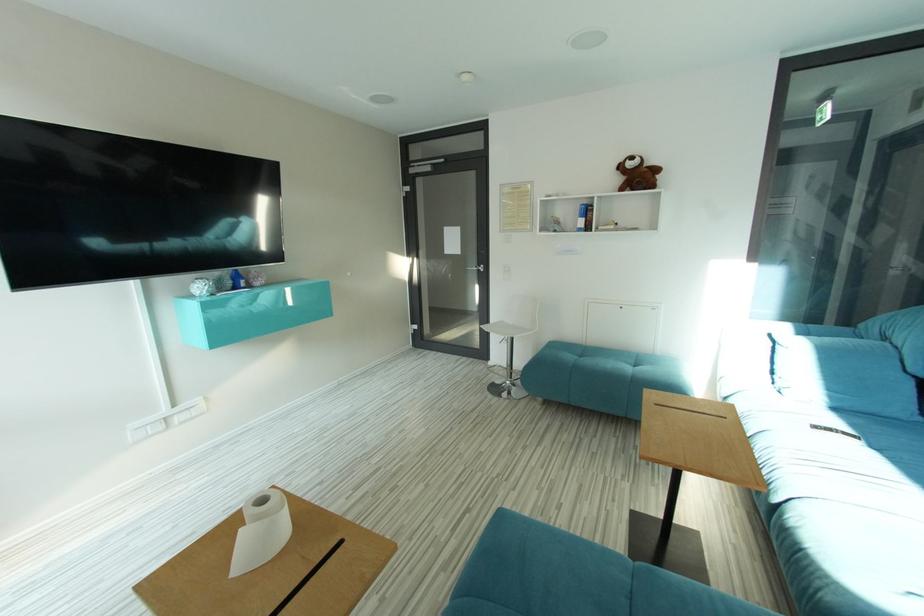
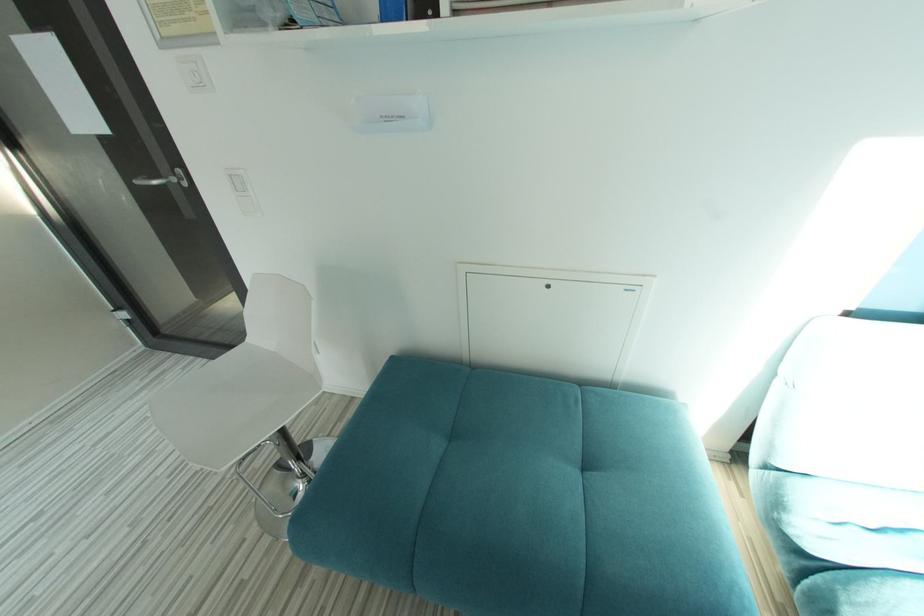
The images are taken continuously from a first-person perspective. In which direction are you moving?

The movement direction of the cameraman is right, forward.